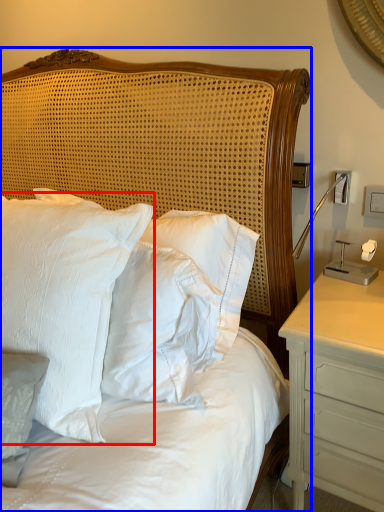
Question: Which object is further to the camera taking this photo, pillow (highlighted by a red box) or bed (highlighted by a blue box)?

Choices:
 (A) pillow
 (B) bed

Answer: (B)